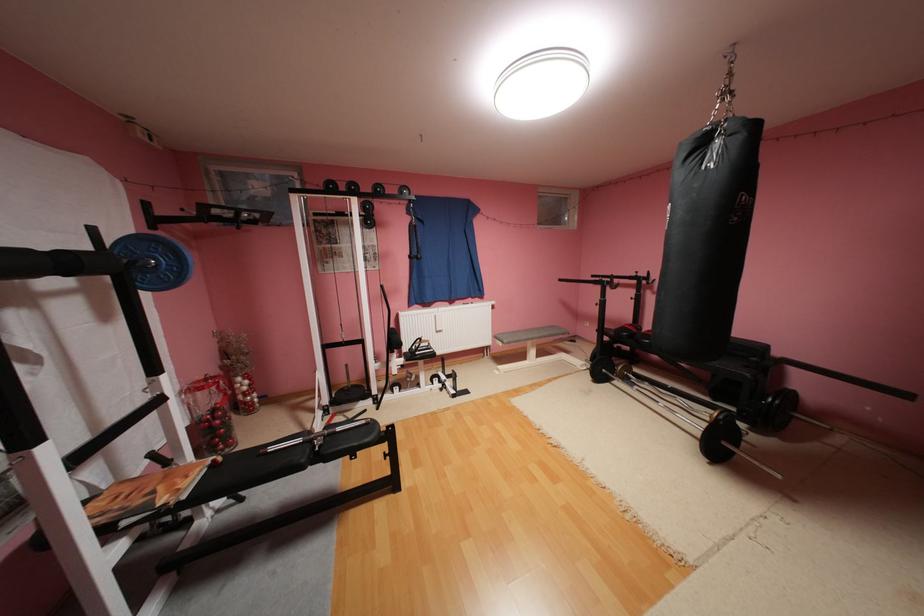
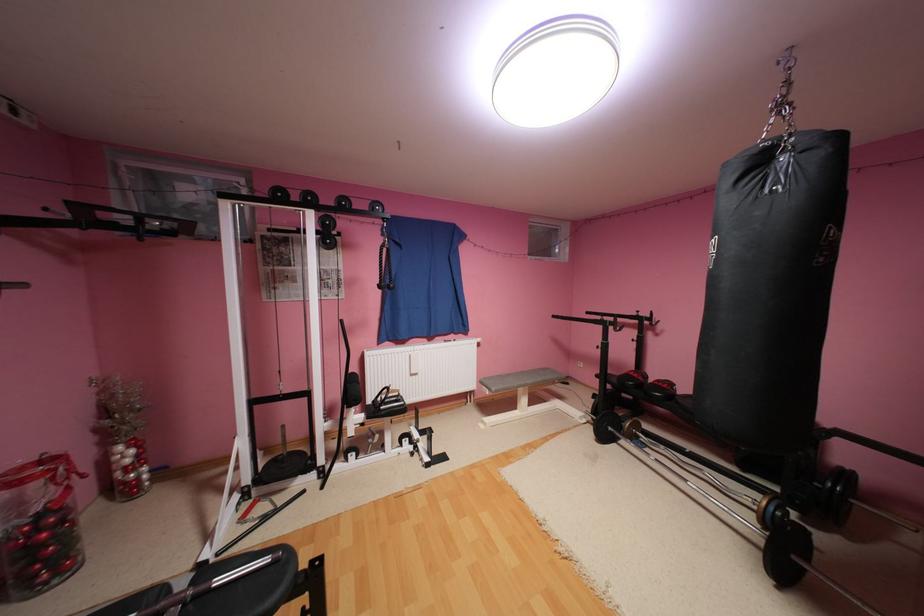
Question: What movement of the cameraman would produce the second image?

Choices:
 (A) Left
 (B) Right
 (C) Forward
 (D) Backward

Answer: (C)